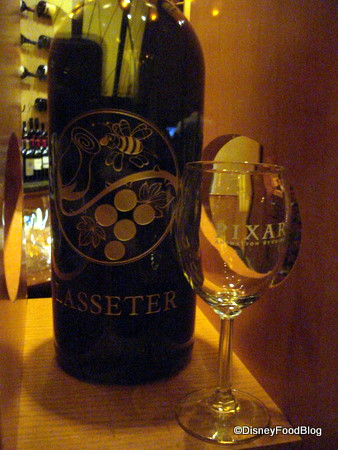
Locate an element on the screen. wine glass is located at coordinates (231, 256).